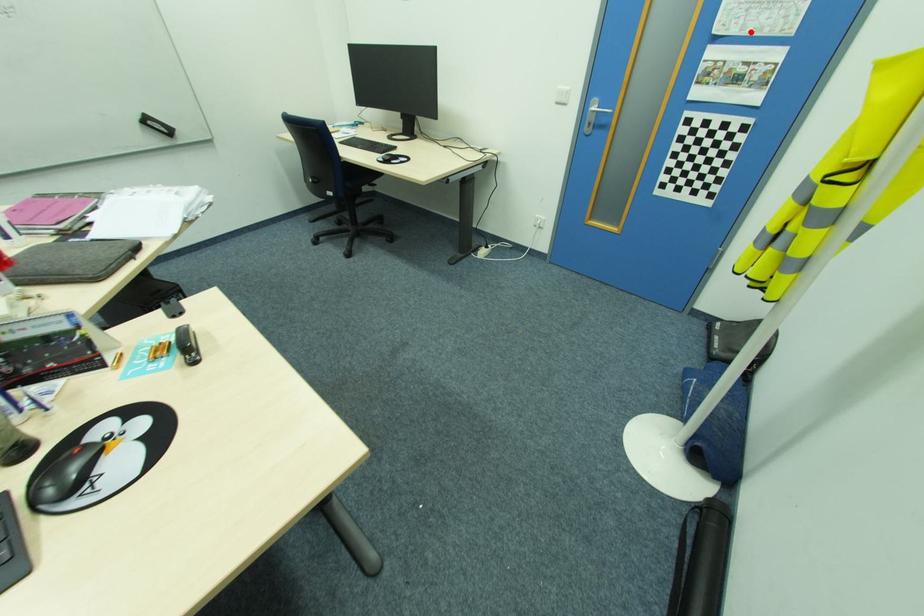
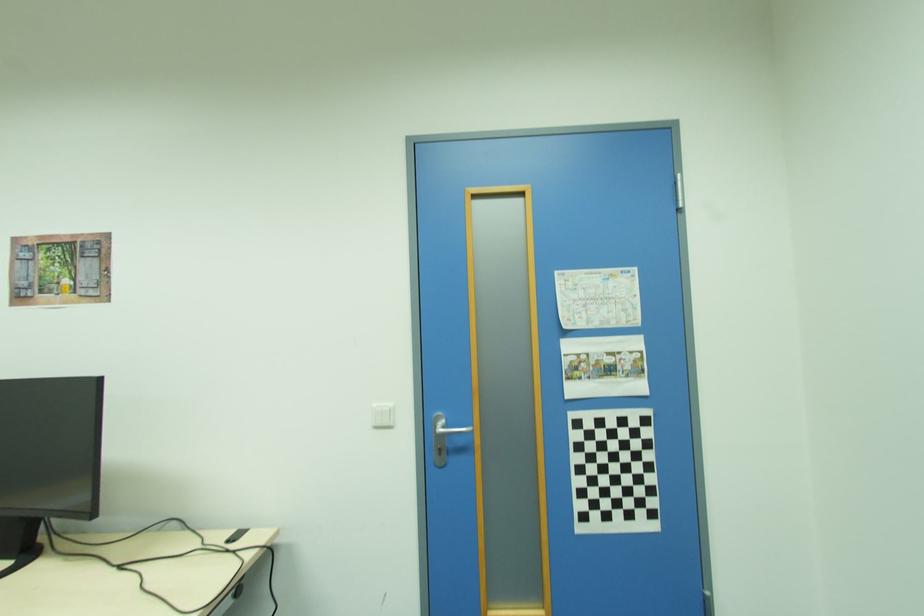
Find the pixel in the second image that matches the highlighted location in the first image.

(599, 325)